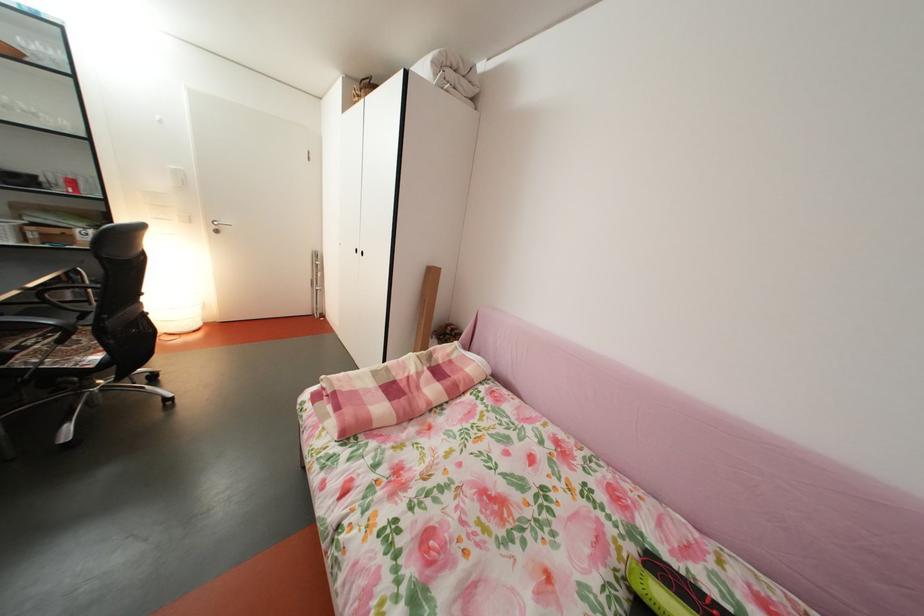
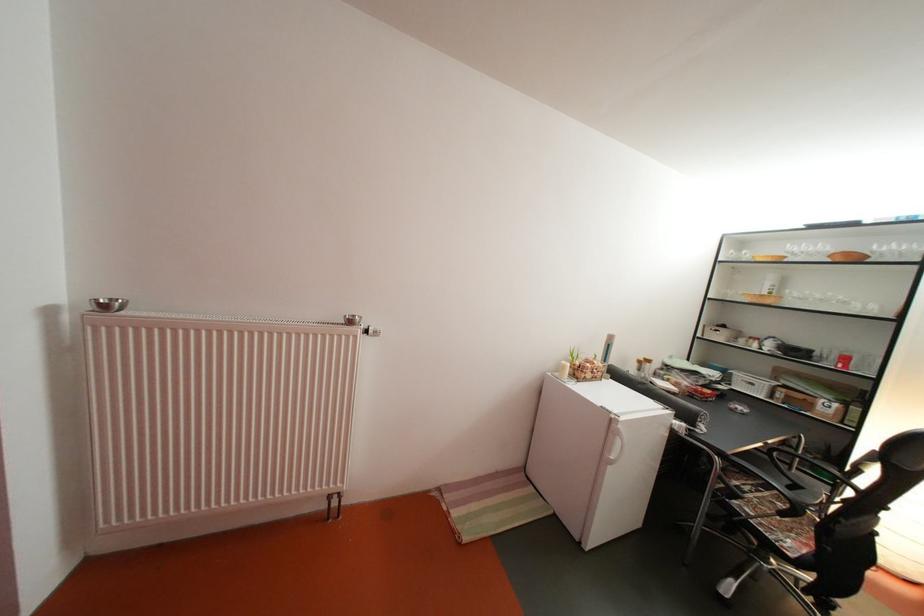
Question: The camera is either moving clockwise (left) or counter-clockwise (right) around the object. The first image is from the beginning of the video and the second image is from the end. Is the camera moving left or right when shooting the video?

Choices:
 (A) Left
 (B) Right

Answer: (B)